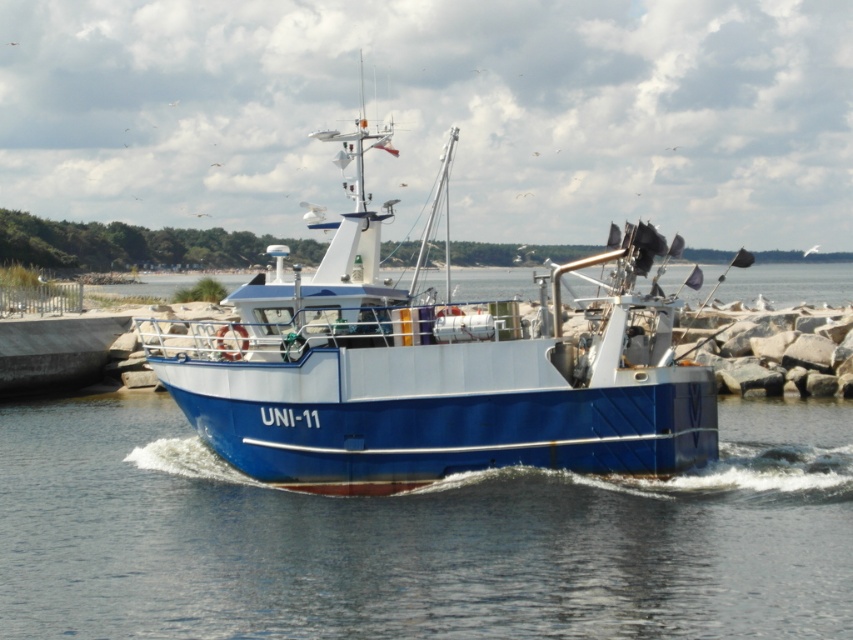
Does blue smooth water at center appear on the right side of blue matte boat at center?

Correct, you'll find blue smooth water at center to the right of blue matte boat at center.

Is blue smooth water at center thinner than blue matte boat at center?

Incorrect, blue smooth water at center's width is not less than blue matte boat at center's.

Between point (28, 483) and point (251, 296), which one is positioned in front?

Point (28, 483) is in front.

Identify the location of blue smooth water at center. This screenshot has width=853, height=640. (418, 538).